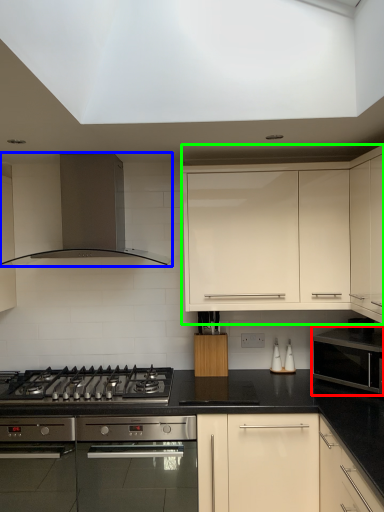
Question: Which object is the farthest from microwave oven (highlighted by a red box)? Choose among these: kitchen appliance (highlighted by a blue box) or cabinetry (highlighted by a green box).

Choices:
 (A) kitchen appliance
 (B) cabinetry

Answer: (A)